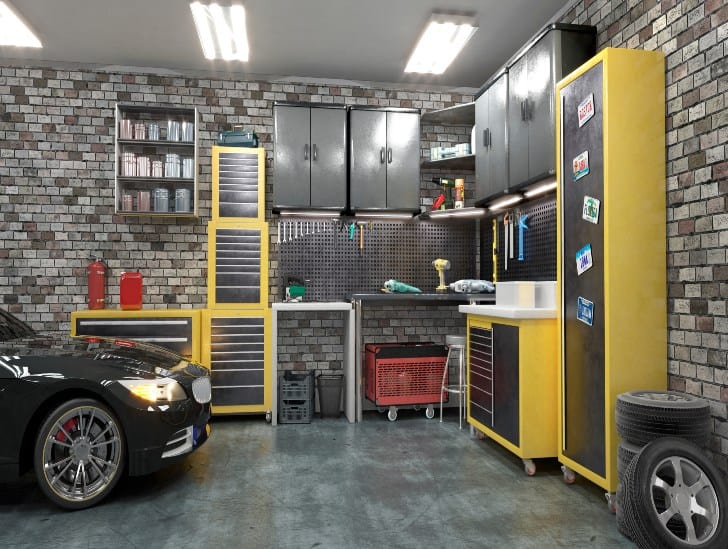
This screenshot has width=728, height=549. Identify the location of garage floor. (419, 540).